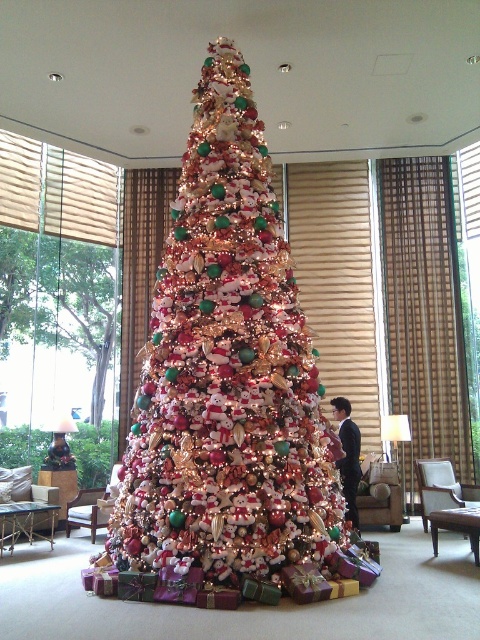
Is the position of shiny metallic christmas tree at center more distant than that of green matte christmas tree at left?

No, shiny metallic christmas tree at center is in front of green matte christmas tree at left.

Based on the photo, who is shorter, shiny metallic christmas tree at center or green matte christmas tree at left?

green matte christmas tree at left is shorter.

Is point (216, 99) farther from viewer compared to point (37, 323)?

No, it is in front of (37, 323).

Where is `shiny metallic christmas tree at center`? shiny metallic christmas tree at center is located at coordinates (227, 374).

Does green matte christmas tree at left appear on the right side of smooth black suit at center?

In fact, green matte christmas tree at left is to the left of smooth black suit at center.

Does green matte christmas tree at left have a larger size compared to smooth black suit at center?

Yes, green matte christmas tree at left is bigger than smooth black suit at center.

At what (x,y) coordinates should I click in order to perform the action: click on green matte christmas tree at left. Please return your answer as a coordinate pair (x, y). This screenshot has height=640, width=480. Looking at the image, I should click on (60, 300).

From the picture: Between shiny metallic christmas tree at center and smooth black suit at center, which one appears on the left side from the viewer's perspective?

shiny metallic christmas tree at center

Is shiny metallic christmas tree at center shorter than smooth black suit at center?

Incorrect, shiny metallic christmas tree at center's height does not fall short of smooth black suit at center's.

Who is more forward, (x=156, y=545) or (x=357, y=460)?

Positioned in front is point (x=156, y=545).

Where is `shiny metallic christmas tree at center`? The height and width of the screenshot is (640, 480). shiny metallic christmas tree at center is located at coordinates (227, 374).